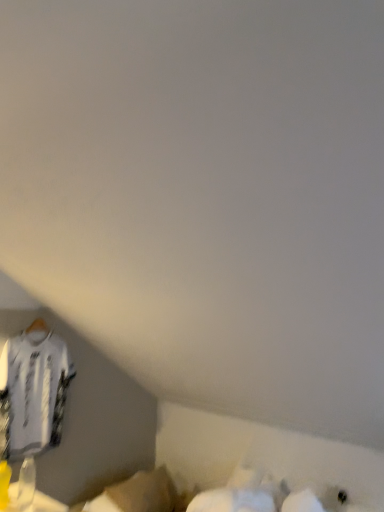
This screenshot has height=512, width=384. Describe the element at coordinates (137, 494) in the screenshot. I see `white fabric at lower center` at that location.

The width and height of the screenshot is (384, 512). What are the coordinates of `white fabric at lower center` in the screenshot? It's located at (137, 494).

The height and width of the screenshot is (512, 384). In order to click on white jersey at left in this screenshot , I will do `click(33, 392)`.

Describe the element at coordinates (33, 392) in the screenshot. This screenshot has width=384, height=512. I see `white jersey at left` at that location.

At what (x,y) coordinates should I click in order to perform the action: click on white fabric at lower center. Please return your answer as a coordinate pair (x, y). Looking at the image, I should click on (137, 494).

Considering the positions of objects white jersey at left and white fabric at lower center in the image provided, who is more to the left, white jersey at left or white fabric at lower center?

Positioned to the left is white jersey at left.

Is white jersey at left positioned before white fabric at lower center?

Yes, the depth of white jersey at left is less than that of white fabric at lower center.

Is point (51, 396) farther from camera compared to point (153, 483)?

No, (51, 396) is in front of (153, 483).

From the image's perspective, between white jersey at left and white fabric at lower center, who is located below?

white fabric at lower center appears lower in the image.

From a real-world perspective, who is located lower, white jersey at left or white fabric at lower center?

white fabric at lower center is physically lower.

Is white jersey at left wider than white fabric at lower center?

No.

Is white jersey at left taller or shorter than white fabric at lower center?

Considering their sizes, white jersey at left has more height than white fabric at lower center.

Considering the sizes of white jersey at left and white fabric at lower center in the image, is white jersey at left bigger or smaller than white fabric at lower center?

Considering their sizes, white jersey at left takes up more space than white fabric at lower center.

Is white jersey at left outside of white fabric at lower center?

white jersey at left is positioned outside white fabric at lower center.

Is the surface of white jersey at left in direct contact with white fabric at lower center?

white jersey at left is not next to white fabric at lower center, and they're not touching.

Does white jersey at left turn towards white fabric at lower center?

No, white jersey at left is not aimed at white fabric at lower center.

How many degrees apart are the facing directions of white jersey at left and white fabric at lower center?

1.2 degrees separate the facing orientations of white jersey at left and white fabric at lower center.

Locate an element on the screen. clothing above the white fabric at lower center (from the image's perspective) is located at coordinates (33, 392).

Looking at this image, is white fabric at lower center to the right of white jersey at left from the viewer's perspective?

Indeed, white fabric at lower center is positioned on the right side of white jersey at left.

Considering the positions of objects white fabric at lower center and white jersey at left in the image provided, who is behind, white fabric at lower center or white jersey at left?

Positioned behind is white fabric at lower center.

Is point (136, 506) behind point (51, 434)?

No, (136, 506) is closer to viewer.

From the image's perspective, which one is positioned lower, white fabric at lower center or white jersey at left?

white fabric at lower center is shown below in the image.

From a real-world perspective, is white fabric at lower center on top of white jersey at left?

Incorrect, from a real-world perspective, white fabric at lower center is lower than white jersey at left.

Is white fabric at lower center wider than white jersey at left?

Indeed, white fabric at lower center has a greater width compared to white jersey at left.

Can you confirm if white fabric at lower center is taller than white jersey at left?

Incorrect, the height of white fabric at lower center is not larger of that of white jersey at left.

Who is bigger, white fabric at lower center or white jersey at left?

white jersey at left.

Is white jersey at left surrounded by white fabric at lower center?

No, white jersey at left is located outside of white fabric at lower center.

Is white fabric at lower center not close to white jersey at left?

No.

Is white fabric at lower center oriented away from white jersey at left?

No, white fabric at lower center's orientation is not away from white jersey at left.

Find the location of a particular element. The height and width of the screenshot is (512, 384). clothing above the white fabric at lower center (from a real-world perspective) is located at coordinates (33, 392).

The image size is (384, 512). In the image, there is a white jersey at left. Find the location of `wide below it (from a real-world perspective)`. wide below it (from a real-world perspective) is located at coordinates [x=137, y=494].

Where is `clothing in front of the white fabric at lower center`? clothing in front of the white fabric at lower center is located at coordinates (33, 392).